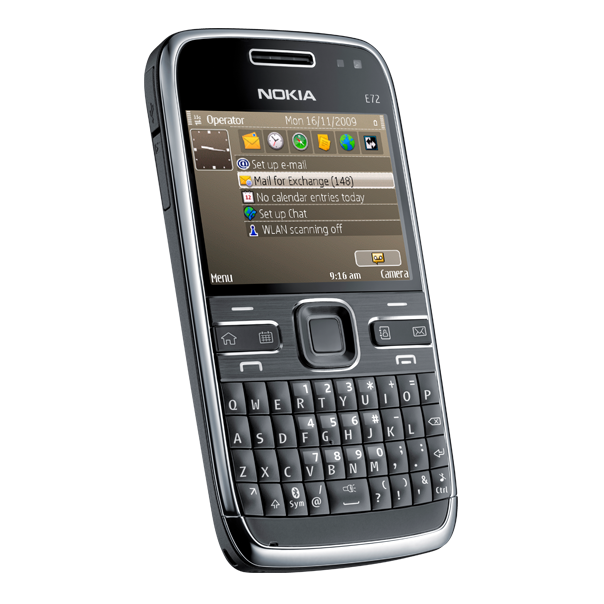
You are a GUI agent. You are given a task and a screenshot of the screen. Output one action in this format:
    pyautogui.click(x=<x>, y=<y>)
    Task: Click on the speaker
    This screenshot has height=604, width=604.
    Given the screenshot: What is the action you would take?
    pyautogui.click(x=277, y=55)